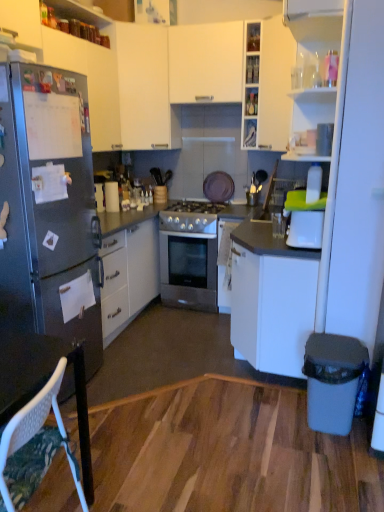
What do you see at coordinates (31, 423) in the screenshot? This screenshot has width=384, height=512. I see `white mesh chair at lower left` at bounding box center [31, 423].

Where is `white mesh chair at lower left`? The image size is (384, 512). white mesh chair at lower left is located at coordinates (31, 423).

Find the location of a particular element. This screenshot has height=512, width=384. black matte oven at center is located at coordinates (188, 272).

Where is `satin silver gas stove at center`? The height and width of the screenshot is (512, 384). satin silver gas stove at center is located at coordinates (190, 217).

Locate an element on the screen. This screenshot has width=384, height=512. white plastic trash can at lower right is located at coordinates (332, 381).

The height and width of the screenshot is (512, 384). What do you see at coordinates (275, 83) in the screenshot? I see `white matte cabinet at upper center, which is counted as the 4th cabinetry, starting from the left` at bounding box center [275, 83].

Where is `metallic silver cabinet at upper left, the 1th cabinetry viewed from the left`? The width and height of the screenshot is (384, 512). metallic silver cabinet at upper left, the 1th cabinetry viewed from the left is located at coordinates (71, 65).

In the scene shown: Is white matte cabinet at upper center, which appears as the second cabinetry when viewed from the right, aimed at white matte cabinet at upper center, which is the 1th cabinetry in right-to-left order?

No, white matte cabinet at upper center, which appears as the second cabinetry when viewed from the right, is not oriented towards white matte cabinet at upper center, which is the 1th cabinetry in right-to-left order.

The width and height of the screenshot is (384, 512). I want to click on cabinetry that is the 2nd object above the white matte cabinet at upper center, which is counted as the 4th cabinetry, starting from the left (from a real-world perspective), so pyautogui.click(x=205, y=63).

Looking at this image, is white matte cabinet at upper center, which appears as the second cabinetry when viewed from the right, wider than white matte cabinet at upper center, which is the 1th cabinetry in right-to-left order?

Incorrect, the width of white matte cabinet at upper center, which appears as the second cabinetry when viewed from the right, does not surpass that of white matte cabinet at upper center, which is the 1th cabinetry in right-to-left order.

Consider the image. In terms of height, does white matte cabinet at upper center, arranged as the 3th cabinetry when viewed from the left, look taller or shorter compared to white matte cabinet at upper center, which is the 1th cabinetry in right-to-left order?

white matte cabinet at upper center, arranged as the 3th cabinetry when viewed from the left, is shorter than white matte cabinet at upper center, which is the 1th cabinetry in right-to-left order.

Where is `chair lying below the satin silver gas stove at center (from the image's perspective)`? chair lying below the satin silver gas stove at center (from the image's perspective) is located at coordinates (31, 423).

From a real-world perspective, is satin silver gas stove at center physically above white mesh chair at lower left?

Yes.

Choose the correct answer: Is satin silver gas stove at center inside white mesh chair at lower left or outside it?

satin silver gas stove at center lies outside white mesh chair at lower left.

Which of these two, metallic silver cabinet at upper left, the 1th cabinetry viewed from the left, or white matte cabinet at upper center, which is the 1th cabinetry in right-to-left order, is wider?

With larger width is white matte cabinet at upper center, which is the 1th cabinetry in right-to-left order.

Are metallic silver cabinet at upper left, marked as the fourth cabinetry in a right-to-left arrangement, and white matte cabinet at upper center, which is counted as the 4th cabinetry, starting from the left, beside each other?

No, metallic silver cabinet at upper left, marked as the fourth cabinetry in a right-to-left arrangement, is not next to white matte cabinet at upper center, which is counted as the 4th cabinetry, starting from the left.

Based on the photo, does metallic silver cabinet at upper left, the 1th cabinetry viewed from the left, turn towards white matte cabinet at upper center, which is the 1th cabinetry in right-to-left order?

Yes, metallic silver cabinet at upper left, the 1th cabinetry viewed from the left, is facing white matte cabinet at upper center, which is the 1th cabinetry in right-to-left order.

Looking at this image, between metallic silver cabinet at upper left, marked as the fourth cabinetry in a right-to-left arrangement, and white matte cabinet at upper center, which is the 1th cabinetry in right-to-left order, which one has less height?

Standing shorter between the two is metallic silver cabinet at upper left, marked as the fourth cabinetry in a right-to-left arrangement.

Is black matte oven at center further to the viewer compared to clear glass shelf at upper center, marked as the second shelf in a top-to-bottom arrangement?

No, black matte oven at center is in front of clear glass shelf at upper center, marked as the second shelf in a top-to-bottom arrangement.

From the image's perspective, which one is positioned lower, black matte oven at center or clear glass shelf at upper center, the 1th shelf from the bottom?

black matte oven at center.

Based on the photo, which object is wider, black matte oven at center or clear glass shelf at upper center, the 1th shelf from the bottom?

With larger width is black matte oven at center.

Which of these two, black matte oven at center or clear glass shelf at upper center, marked as the second shelf in a top-to-bottom arrangement, is smaller?

With smaller size is clear glass shelf at upper center, marked as the second shelf in a top-to-bottom arrangement.

Can you confirm if white mesh chair at lower left is positioned to the right of clear glass shelf at upper center, the 1th shelf from the bottom?

Incorrect, white mesh chair at lower left is not on the right side of clear glass shelf at upper center, the 1th shelf from the bottom.

Does white mesh chair at lower left have a larger size compared to clear glass shelf at upper center, marked as the second shelf in a top-to-bottom arrangement?

Yes.

From the image's perspective, who appears lower, white mesh chair at lower left or clear glass shelf at upper center, marked as the second shelf in a top-to-bottom arrangement?

white mesh chair at lower left is shown below in the image.

Is white mesh chair at lower left positioned with its back to clear glass shelf at upper center, marked as the second shelf in a top-to-bottom arrangement?

No.

Based on the photo, considering the positions of objects white matte cabinet at upper center, which is counted as the 4th cabinetry, starting from the left, and white matte cabinet at upper center, arranged as the 3th cabinetry when viewed from the left, in the image provided, who is more to the right, white matte cabinet at upper center, which is counted as the 4th cabinetry, starting from the left, or white matte cabinet at upper center, arranged as the 3th cabinetry when viewed from the left,?

Positioned to the right is white matte cabinet at upper center, which is counted as the 4th cabinetry, starting from the left.

Is white matte cabinet at upper center, which is counted as the 4th cabinetry, starting from the left, looking in the opposite direction of white matte cabinet at upper center, arranged as the 3th cabinetry when viewed from the left?

No, white matte cabinet at upper center, arranged as the 3th cabinetry when viewed from the left, is not at the back of white matte cabinet at upper center, which is counted as the 4th cabinetry, starting from the left.

How much distance is there between white matte cabinet at upper center, which is counted as the 4th cabinetry, starting from the left, and white matte cabinet at upper center, arranged as the 3th cabinetry when viewed from the left?

The distance of white matte cabinet at upper center, which is counted as the 4th cabinetry, starting from the left, from white matte cabinet at upper center, arranged as the 3th cabinetry when viewed from the left, is 12.16 inches.

Considering the sizes of objects white matte cabinet at upper center, which is counted as the 4th cabinetry, starting from the left, and white matte cabinet at upper center, arranged as the 3th cabinetry when viewed from the left, in the image provided, who is bigger, white matte cabinet at upper center, which is counted as the 4th cabinetry, starting from the left, or white matte cabinet at upper center, arranged as the 3th cabinetry when viewed from the left,?

With larger size is white matte cabinet at upper center, which is counted as the 4th cabinetry, starting from the left.

Considering the relative positions of clear glass bottles at upper center, the 1th shelf positioned from the top, and clear glass shelf at upper center, the 1th shelf from the bottom, in the image provided, is clear glass bottles at upper center, the 1th shelf positioned from the top, to the left of clear glass shelf at upper center, the 1th shelf from the bottom, from the viewer's perspective?

Correct, you'll find clear glass bottles at upper center, the 1th shelf positioned from the top, to the left of clear glass shelf at upper center, the 1th shelf from the bottom.

Considering the positions of point (247, 78) and point (248, 103), is point (247, 78) closer or farther from the camera than point (248, 103)?

Point (247, 78) is positioned closer to the camera compared to point (248, 103).

Is clear glass bottles at upper center, which ranks as the second shelf in bottom-to-top order, aimed at clear glass shelf at upper center, the 1th shelf from the bottom?

No.

Where is `cabinetry that is the 1st object located in front of the white matte cabinet at upper center, arranged as the 3th cabinetry when viewed from the left`? Image resolution: width=384 pixels, height=512 pixels. cabinetry that is the 1st object located in front of the white matte cabinet at upper center, arranged as the 3th cabinetry when viewed from the left is located at coordinates (275, 83).

At what (x,y) coordinates should I click in order to perform the action: click on gas stove behind the white mesh chair at lower left. Please return your answer as a coordinate pair (x, y). Image resolution: width=384 pixels, height=512 pixels. Looking at the image, I should click on (190, 217).

Looking at the image, which one is located closer to white matte cabinet at upper center, which is counted as the 4th cabinetry, starting from the left, white plastic trash can at lower right or white matte cabinet at upper center, which appears as the second cabinetry when viewed from the right?

white matte cabinet at upper center, which appears as the second cabinetry when viewed from the right.

When comparing their distances from metallic silver cabinet at upper left, marked as the fourth cabinetry in a right-to-left arrangement, does white plastic trash can at lower right or clear glass bottles at upper center, which ranks as the second shelf in bottom-to-top order, seem further?

Based on the image, white plastic trash can at lower right appears to be further to metallic silver cabinet at upper left, marked as the fourth cabinetry in a right-to-left arrangement.

Estimate the real-world distances between objects in this image. Which object is further from white plastic trash can at lower right, clear glass shelf at upper center, marked as the second shelf in a top-to-bottom arrangement, or satin silver gas stove at center?

Among the two, clear glass shelf at upper center, marked as the second shelf in a top-to-bottom arrangement, is located further to white plastic trash can at lower right.

Looking at the image, which one is located closer to white mesh chair at lower left, white matte cabinet at upper center, which is counted as the 4th cabinetry, starting from the left, or white matte cabinet at upper center, placed as the second cabinetry when sorted from left to right?

The object closer to white mesh chair at lower left is white matte cabinet at upper center, placed as the second cabinetry when sorted from left to right.

Looking at this image, estimate the real-world distances between objects in this image. Which object is further from white matte cabinet at upper center, marked as the third cabinetry in a right-to-left arrangement, clear glass shelf at upper center, marked as the second shelf in a top-to-bottom arrangement, or metallic silver cabinet at upper left, marked as the fourth cabinetry in a right-to-left arrangement?

Among the two, clear glass shelf at upper center, marked as the second shelf in a top-to-bottom arrangement, is located further to white matte cabinet at upper center, marked as the third cabinetry in a right-to-left arrangement.

Based on their spatial positions, is clear glass bottles at upper center, which ranks as the second shelf in bottom-to-top order, or metallic silver cabinet at upper left, the 1th cabinetry viewed from the left, further from white matte cabinet at upper center, marked as the third cabinetry in a right-to-left arrangement?

clear glass bottles at upper center, which ranks as the second shelf in bottom-to-top order, is positioned further to the anchor white matte cabinet at upper center, marked as the third cabinetry in a right-to-left arrangement.

Considering their positions, is clear glass bottles at upper center, the 1th shelf positioned from the top, positioned closer to black matte oven at center than satin silver gas stove at center?

The object closer to black matte oven at center is satin silver gas stove at center.

Estimate the real-world distances between objects in this image. Which object is further from white plastic trash can at lower right, white matte cabinet at upper center, placed as the second cabinetry when sorted from left to right, or black matte oven at center?

white matte cabinet at upper center, placed as the second cabinetry when sorted from left to right, is further to white plastic trash can at lower right.

Find the location of a particular element. This screenshot has height=512, width=384. cabinetry located between white matte cabinet at upper center, marked as the third cabinetry in a right-to-left arrangement, and white matte cabinet at upper center, which is counted as the 4th cabinetry, starting from the left, in the left-right direction is located at coordinates (205, 63).

Locate an element on the screen. This screenshot has width=384, height=512. cabinetry between white matte cabinet at upper center, marked as the third cabinetry in a right-to-left arrangement, and clear glass bottles at upper center, which ranks as the second shelf in bottom-to-top order, from left to right is located at coordinates (205, 63).

In order to click on oven between metallic silver cabinet at upper left, the 1th cabinetry viewed from the left, and white plastic trash can at lower right vertically in this screenshot , I will do `click(188, 272)`.

The image size is (384, 512). What are the coordinates of `gas stove between clear glass shelf at upper center, marked as the second shelf in a top-to-bottom arrangement, and white plastic trash can at lower right in the up-down direction` in the screenshot? It's located at (190, 217).